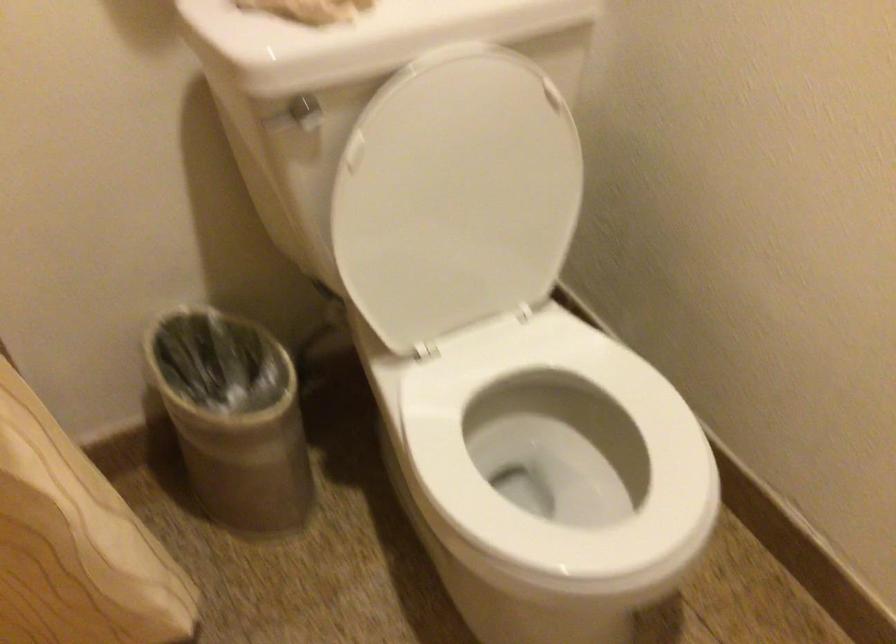
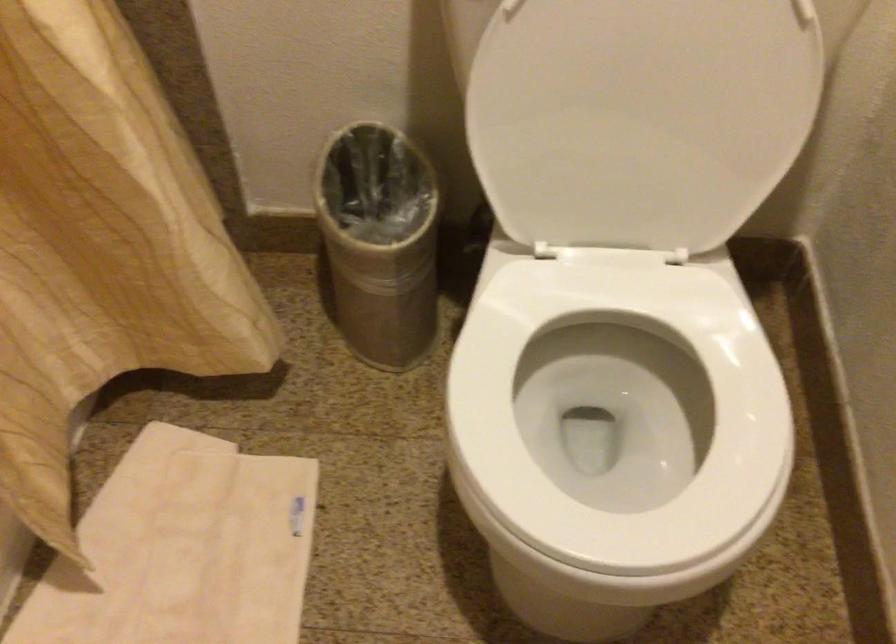
Question: The camera is either moving clockwise (left) or counter-clockwise (right) around the object. The first image is from the beginning of the video and the second image is from the end. Is the camera moving left or right when shooting the video?

Choices:
 (A) Left
 (B) Right

Answer: (B)